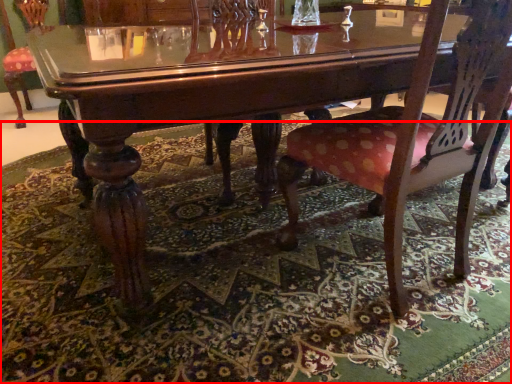
Question: From the image's perspective, considering the relative positions of mat (annotated by the red box) and chair in the image provided, where is mat (annotated by the red box) located with respect to the staircase?

Choices:
 (A) above
 (B) below

Answer: (B)